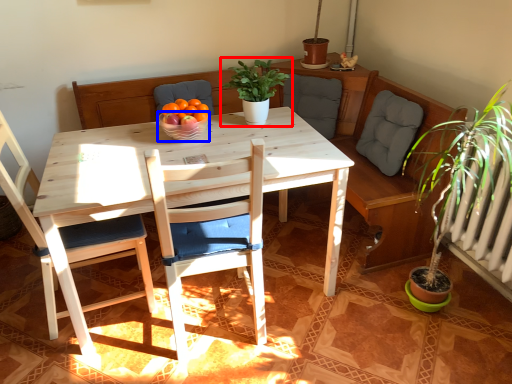
Question: Among these objects, which one is farthest to the camera, houseplant (highlighted by a red box) or glass bowl (highlighted by a blue box)?

Choices:
 (A) houseplant
 (B) glass bowl

Answer: (A)